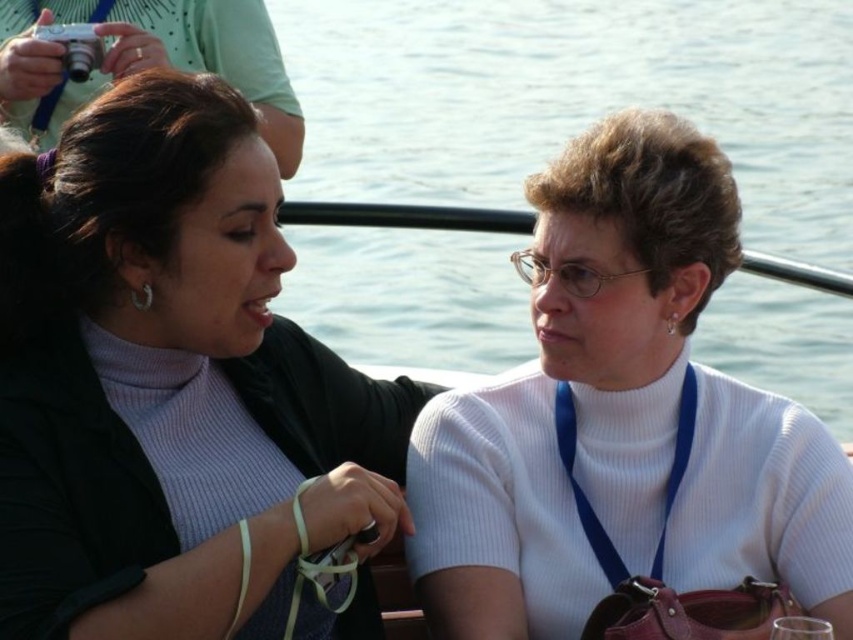
Who is higher up, matte black jacket at left or white ribbed sweater at center?

Positioned higher is matte black jacket at left.

From the picture: Which is more to the left, matte black jacket at left or white ribbed sweater at center?

matte black jacket at left is more to the left.

Who is more distant from viewer, (49, 600) or (540, 604)?

Positioned behind is point (540, 604).

Locate an element on the screen. This screenshot has height=640, width=853. matte black jacket at left is located at coordinates point(170,384).

Does clear blue water at center have a lesser height compared to white ribbed sweater at center?

Incorrect, clear blue water at center's height does not fall short of white ribbed sweater at center's.

Is point (492, 93) positioned before point (569, 216)?

No, it is behind (569, 216).

Locate an element on the screen. clear blue water at center is located at coordinates (573, 99).

How much distance is there between matte black jacket at left and clear blue water at center?

matte black jacket at left is 28.12 meters from clear blue water at center.

Based on the photo, which is below, matte black jacket at left or clear blue water at center?

matte black jacket at left is below.

The width and height of the screenshot is (853, 640). I want to click on matte black jacket at left, so click(170, 384).